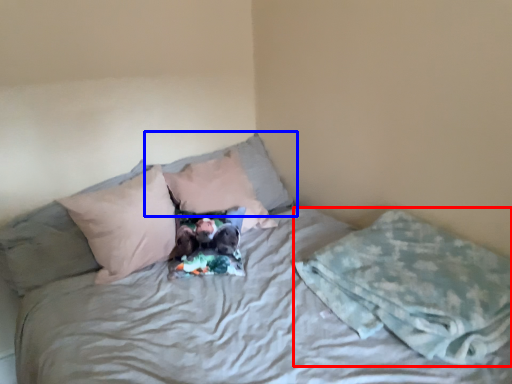
Question: Which point is further to the camera, blanket (highlighted by a red box) or pillow (highlighted by a blue box)?

Choices:
 (A) blanket
 (B) pillow

Answer: (B)